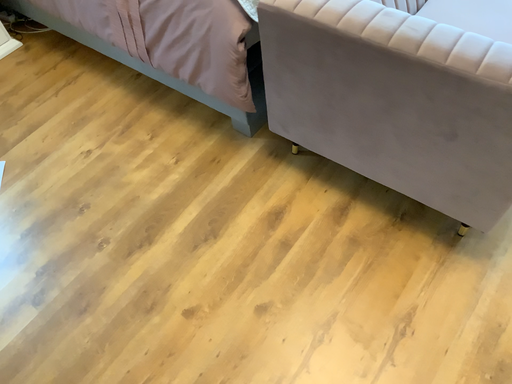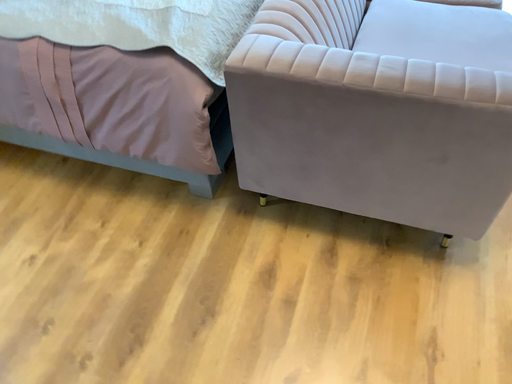
Question: Which way did the camera rotate in the video?

Choices:
 (A) rotated right
 (B) rotated left

Answer: (A)